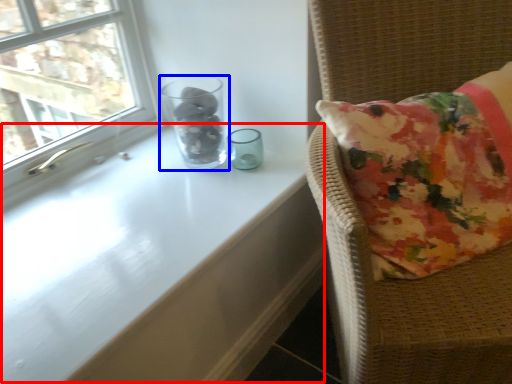
Question: Which point is further to the camera, table (highlighted by a red box) or glass vase (highlighted by a blue box)?

Choices:
 (A) table
 (B) glass vase

Answer: (B)